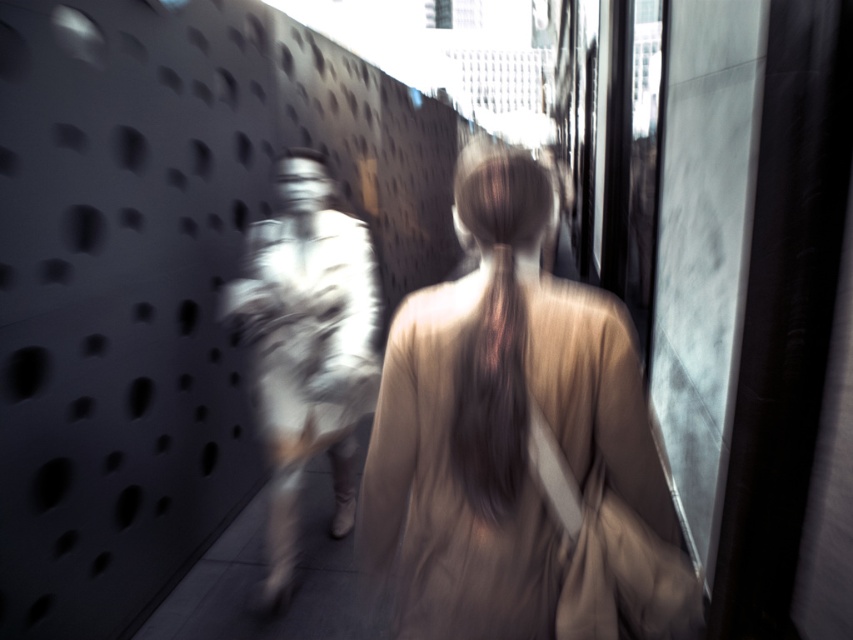
Describe the element at coordinates (515, 444) in the screenshot. Image resolution: width=853 pixels, height=640 pixels. I see `matte beige dress at center` at that location.

Is point (618, 477) positioned after point (265, 532)?

No, it is in front of (265, 532).

Is point (419, 625) in front of point (332, 445)?

Yes, point (419, 625) is closer to viewer.

You are a GUI agent. You are given a task and a screenshot of the screen. Output one action in this format:
    pyautogui.click(x=<x>, y=<y>)
    Task: Click on the matte beige dress at center
    Image resolution: width=853 pixels, height=640 pixels.
    Given the screenshot: What is the action you would take?
    pyautogui.click(x=515, y=444)